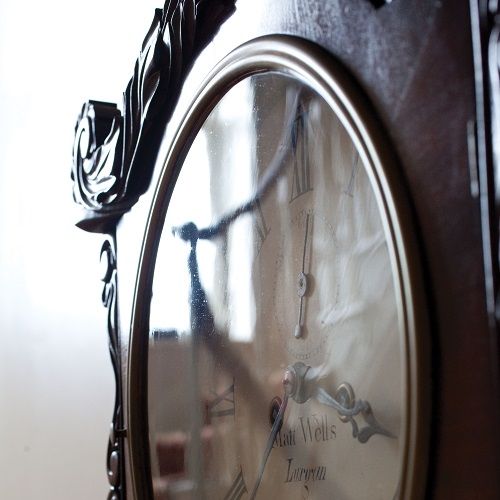
At what (x,y) coordinates should I click in order to perform the action: click on reflection on clock. Please return your answer as a coordinate pair (x, y). This screenshot has width=500, height=500. Looking at the image, I should click on (171, 301), (166, 408), (244, 283), (240, 136), (172, 460).